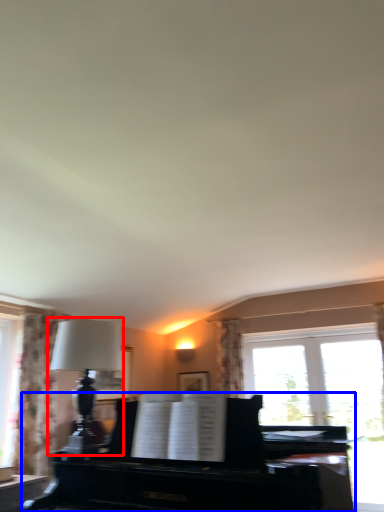
Question: Which object is further to the camera taking this photo, table lamp (highlighted by a red box) or piano (highlighted by a blue box)?

Choices:
 (A) table lamp
 (B) piano

Answer: (A)